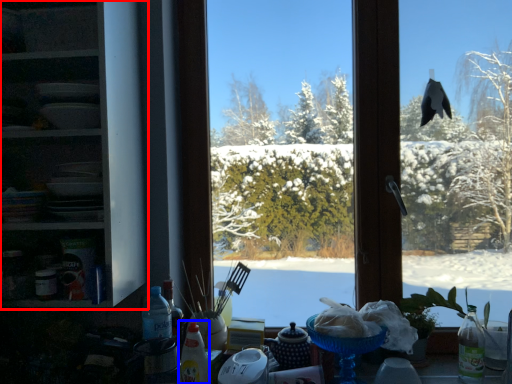
Question: Which object is closer to the camera taking this photo, shelf (highlighted by a red box) or bottle (highlighted by a blue box)?

Choices:
 (A) shelf
 (B) bottle

Answer: (A)